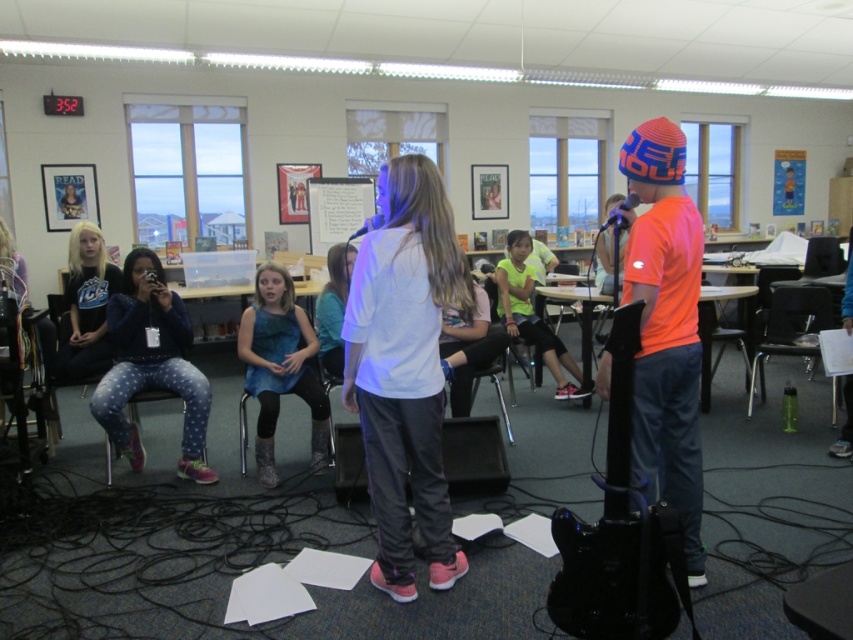
From the picture: You are organizing a classroom event and need to know the relative sizes of the objects. Which object is larger, the white matte shirt at center or the metallic silver chair at lower right?

The metallic silver chair at lower right is larger than the white matte shirt at center.

Consider the image. You are a stagehand who needs to move a 7.5 feet long extension cord from the metallic silver chair at lower right to the white matte shirt at center. Can you lay the cord directly between them without bending it?

The distance between the white matte shirt at center and the metallic silver chair at lower right is 8.44 feet, which is longer than the 7.5 feet extension cord. Therefore, the cord cannot reach without bending.

You are a photographer setting up for a school play. You need to ensure that the orange knit beanie at upper right and the matte black shirt at left are both visible in your shot. Given their sizes, which object should you focus on first to frame the shot properly?

The orange knit beanie at upper right is bigger than the matte black shirt at left, so you should focus on the orange knit beanie at upper right first to ensure it fits within the frame before adjusting for the smaller matte black shirt at left.